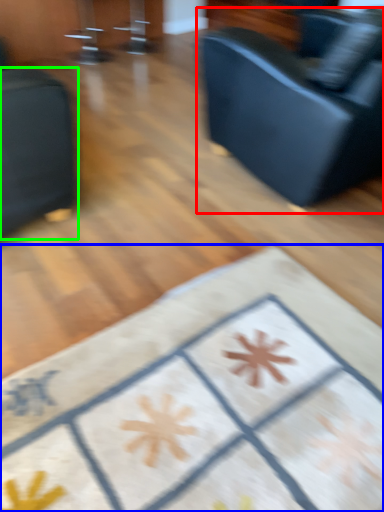
Question: Estimate the real-world distances between objects in this image. Which object is closer to studio couch (highlighted by a red box), furniture (highlighted by a blue box) or furniture (highlighted by a green box)?

Choices:
 (A) furniture
 (B) furniture

Answer: (B)